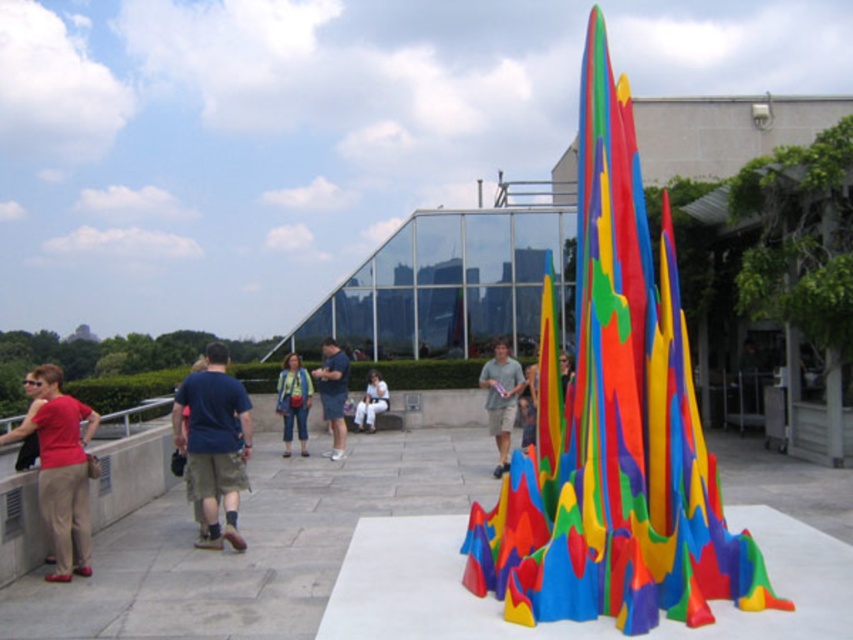
You are a fashion designer observing a model wearing the matte gray shirt at center and matte white pants at center. Which clothing item is located to the right of the other?

The matte gray shirt at center is positioned on the right side of matte white pants at center.

You are standing in front of the sculpture and want to place a 10 feet long ladder between the blue fabric shirt at center and the blue cotton shirt at center. Will the ladder fit between them?

The distance between the blue fabric shirt at center and the blue cotton shirt at center is 11.59 feet, so the 10 feet long ladder will fit between them since it is shorter than the distance.

You are organizing a clothing display and need to place the matte gray shirt at center and the blue cotton shirt at center. Since they are both at the center, which one should you place first to ensure the other is visible?

The matte gray shirt at center should be placed over the blue cotton shirt at center first so that the blue cotton shirt remains visible underneath.